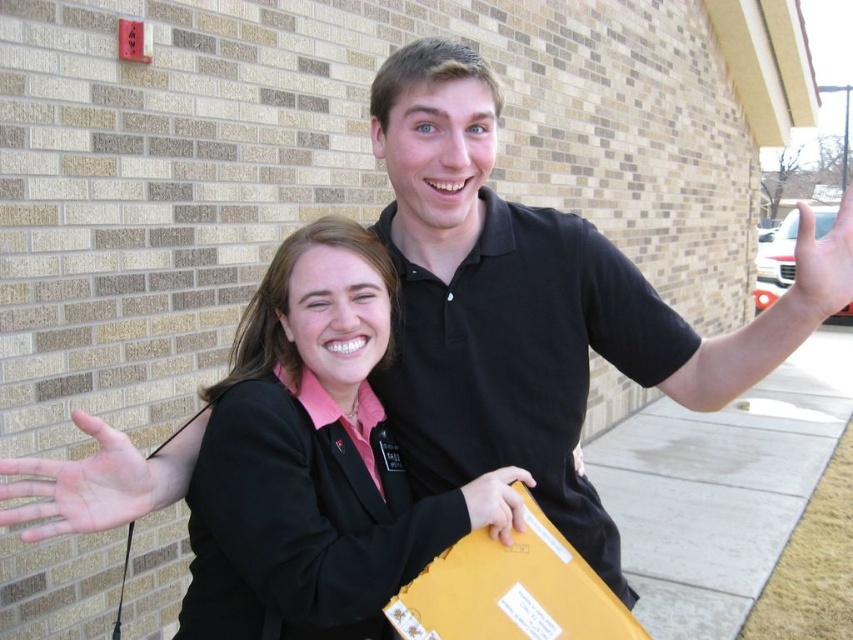
Looking at this image, can you confirm if black matte jacket at center is wider than yellow cardboard box at lower center?

Correct, the width of black matte jacket at center exceeds that of yellow cardboard box at lower center.

Is black matte jacket at center positioned before yellow cardboard box at lower center?

No, black matte jacket at center is further to the viewer.

Describe the element at coordinates (306, 458) in the screenshot. I see `black matte jacket at center` at that location.

Find the location of a particular element. This screenshot has height=640, width=853. black matte jacket at center is located at coordinates [x=306, y=458].

Is black matte jacket at center further to camera compared to matte yellow folder at center?

No, black matte jacket at center is closer to the viewer.

Is black matte jacket at center closer to camera compared to matte yellow folder at center?

That is True.

What do you see at coordinates (306, 458) in the screenshot? I see `black matte jacket at center` at bounding box center [306, 458].

Find the location of a particular element. black matte jacket at center is located at coordinates (306, 458).

Which is above, black matte jacket at center or matte yellow envelope at right?

matte yellow envelope at right is above.

Who is more forward, (376,305) or (834,250)?

Point (834,250) is in front.

The height and width of the screenshot is (640, 853). What do you see at coordinates (306, 458) in the screenshot?
I see `black matte jacket at center` at bounding box center [306, 458].

This screenshot has height=640, width=853. I want to click on black matte jacket at center, so click(x=306, y=458).